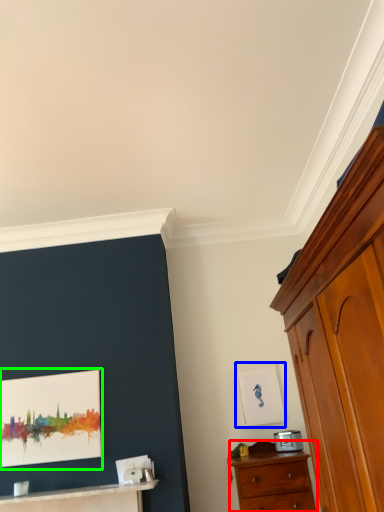
Question: Which object is the closest to the chest of drawers (highlighted by a red box)? Choose among these: picture frame (highlighted by a blue box) or picture frame (highlighted by a green box).

Choices:
 (A) picture frame
 (B) picture frame

Answer: (A)